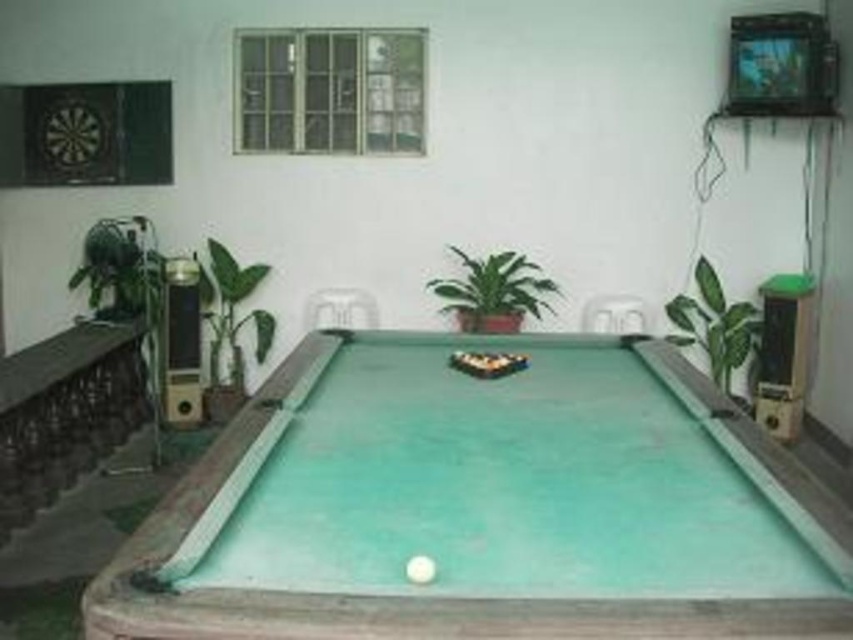
You are a GUI agent. You are given a task and a screenshot of the screen. Output one action in this format:
    pyautogui.click(x=<x>, y=<y>)
    Task: Click on the green felt billiard table at center
    The width and height of the screenshot is (853, 640).
    Given the screenshot: What is the action you would take?
    pyautogui.click(x=378, y=595)

Does green felt billiard table at center appear on the right side of green leafy plant at left?

Yes, green felt billiard table at center is to the right of green leafy plant at left.

Which is behind, point (270, 388) or point (219, 340)?

Positioned behind is point (219, 340).

This screenshot has height=640, width=853. I want to click on green felt billiard table at center, so click(x=378, y=595).

Does green glossy plant at center have a greater width compared to green leafy plant at left?

Correct, the width of green glossy plant at center exceeds that of green leafy plant at left.

In order to click on green glossy plant at center in this screenshot , I will do `click(492, 291)`.

Between point (735, 360) and point (268, 339), which one is positioned behind?

Point (268, 339)

Can you confirm if green leafy plant at right is smaller than green leafy plant at left?

No.

Is point (718, 321) farther from camera compared to point (216, 380)?

No, it is in front of (216, 380).

Where is `green leafy plant at right`? The width and height of the screenshot is (853, 640). green leafy plant at right is located at coordinates (714, 324).